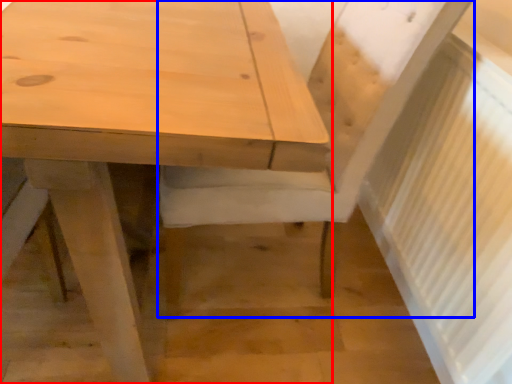
Question: Which of the following is the closest to the observer, table (highlighted by a red box) or chair (highlighted by a blue box)?

Choices:
 (A) table
 (B) chair

Answer: (A)